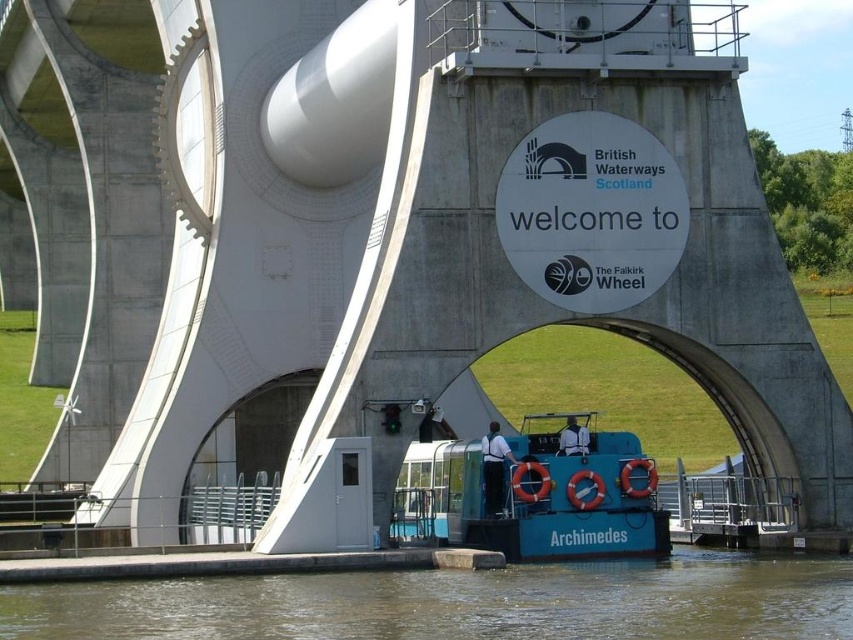
You are standing at the base of the Falkirk Wheel and notice a point marked at coordinates (x=461, y=602). Based on the scene description, what does this point most likely represent?

The point at coordinates (x=461, y=602) corresponds to the brown murky water at lower center.

You are a boat operator who needs to navigate the blue rubber boat at center through the Falkirk Wheel. Based on the scene description, can you safely pass under the wheel without hitting the brown murky water at lower center?

The brown murky water at lower center is below the blue rubber boat at center, so the boat can safely pass under the wheel without hitting the water as it is positioned lower.